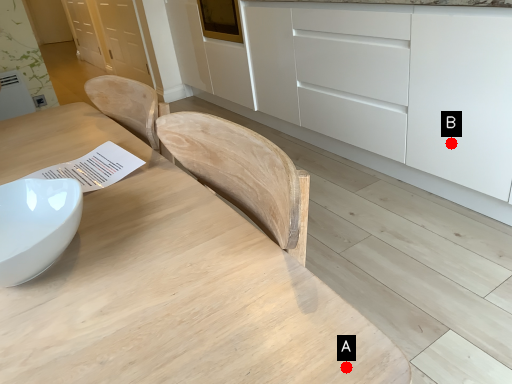
Question: Two points are circled on the image, labeled by A and B beside each circle. Which point appears farthest from the camera in this image?

Choices:
 (A) A is further
 (B) B is further

Answer: (B)